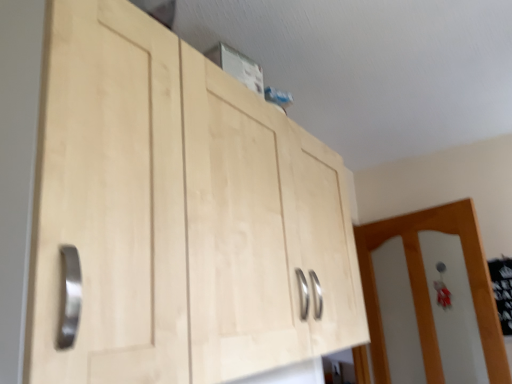
What do you see at coordinates (114, 193) in the screenshot? This screenshot has width=512, height=384. I see `natural wood cabinet at upper center` at bounding box center [114, 193].

Locate an element on the screen. The height and width of the screenshot is (384, 512). natural wood cabinet at upper center is located at coordinates (114, 193).

Based on the photo, what is the approximate height of natural wood cabinet at upper center?

natural wood cabinet at upper center is 29.47 inches tall.

The width and height of the screenshot is (512, 384). Describe the element at coordinates (426, 289) in the screenshot. I see `white glossy door at right` at that location.

What is the approximate width of white glossy door at right?

It is 14.43 centimeters.

Where is `white glossy door at right`? The height and width of the screenshot is (384, 512). white glossy door at right is located at coordinates 426,289.

Find the location of a particular element. This screenshot has width=512, height=384. natural wood cabinet at upper center is located at coordinates (114, 193).

Between natural wood cabinet at upper center and white glossy door at right, which one appears on the right side from the viewer's perspective?

From the viewer's perspective, white glossy door at right appears more on the right side.

Is the depth of natural wood cabinet at upper center greater than that of white glossy door at right?

No, natural wood cabinet at upper center is in front of white glossy door at right.

Is point (104, 129) closer or farther from the camera than point (378, 345)?

Point (104, 129).

From the image's perspective, is natural wood cabinet at upper center located above or below white glossy door at right?

Based on their image positions, natural wood cabinet at upper center is located above white glossy door at right.

From a real-world perspective, is natural wood cabinet at upper center positioned over white glossy door at right based on gravity?

Yes, from a real-world perspective, natural wood cabinet at upper center is above white glossy door at right.

Which object is wider, natural wood cabinet at upper center or white glossy door at right?

natural wood cabinet at upper center.

Considering the relative sizes of natural wood cabinet at upper center and white glossy door at right in the image provided, is natural wood cabinet at upper center shorter than white glossy door at right?

Yes.

Based on their sizes in the image, would you say natural wood cabinet at upper center is bigger or smaller than white glossy door at right?

Clearly, natural wood cabinet at upper center is larger in size than white glossy door at right.

Is natural wood cabinet at upper center inside the boundaries of white glossy door at right, or outside?

natural wood cabinet at upper center exists outside the volume of white glossy door at right.

Is natural wood cabinet at upper center not near white glossy door at right?

Yes.

Is natural wood cabinet at upper center aimed at white glossy door at right?

No.

Can you tell me how much natural wood cabinet at upper center and white glossy door at right differ in facing direction?

There is a 108-degree angle between the facing directions of natural wood cabinet at upper center and white glossy door at right.

Measure the distance from natural wood cabinet at upper center to white glossy door at right.

natural wood cabinet at upper center is 4.53 feet from white glossy door at right.

Find the location of `cupboard that is in front of the white glossy door at right`. cupboard that is in front of the white glossy door at right is located at coordinates (114, 193).

Considering the positions of objects white glossy door at right and natural wood cabinet at upper center in the image provided, who is more to the left, white glossy door at right or natural wood cabinet at upper center?

natural wood cabinet at upper center is more to the left.

Which object is more forward, white glossy door at right or natural wood cabinet at upper center?

natural wood cabinet at upper center.

Is point (404, 216) closer or farther from the camera than point (293, 333)?

Point (404, 216) is positioned farther from the camera compared to point (293, 333).

From the image's perspective, which one is positioned lower, white glossy door at right or natural wood cabinet at upper center?

From the image's view, white glossy door at right is below.

From a real-world perspective, between white glossy door at right and natural wood cabinet at upper center, who is vertically higher?

In real-world perspective, natural wood cabinet at upper center is above.

Considering the sizes of white glossy door at right and natural wood cabinet at upper center in the image, is white glossy door at right wider or thinner than natural wood cabinet at upper center?

In the image, white glossy door at right appears to be more narrow than natural wood cabinet at upper center.

Between white glossy door at right and natural wood cabinet at upper center, which one has more height?

white glossy door at right.

Based on the photo, looking at the image, does white glossy door at right seem bigger or smaller compared to natural wood cabinet at upper center?

white glossy door at right is smaller than natural wood cabinet at upper center.

Which is correct: white glossy door at right is inside natural wood cabinet at upper center, or outside of it?

white glossy door at right is outside natural wood cabinet at upper center.

Is white glossy door at right with natural wood cabinet at upper center?

No, white glossy door at right is not next to natural wood cabinet at upper center.

In the scene shown: Is white glossy door at right oriented away from natural wood cabinet at upper center?

No.

Find the location of `door behind the natural wood cabinet at upper center`. door behind the natural wood cabinet at upper center is located at coordinates (426, 289).

At what (x,y) coordinates should I click in order to perform the action: click on door lying on the right of natural wood cabinet at upper center. Please return your answer as a coordinate pair (x, y). The height and width of the screenshot is (384, 512). Looking at the image, I should click on (426, 289).

Identify the location of door that is under the natural wood cabinet at upper center (from a real-world perspective). The image size is (512, 384). (426, 289).